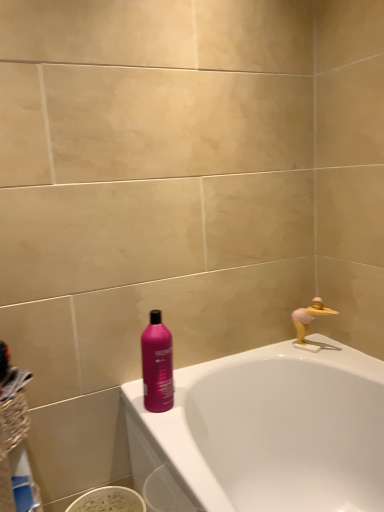
Image resolution: width=384 pixels, height=512 pixels. What are the coordinates of `vacant space that is to the left of yellow rubber duck at upper right` in the screenshot? It's located at (284, 351).